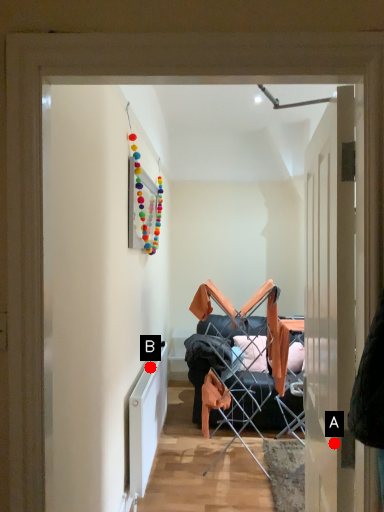
Question: Two points are circled on the image, labeled by A and B beside each circle. Which of the following is the farthest from the observer?

Choices:
 (A) A is further
 (B) B is further

Answer: (B)